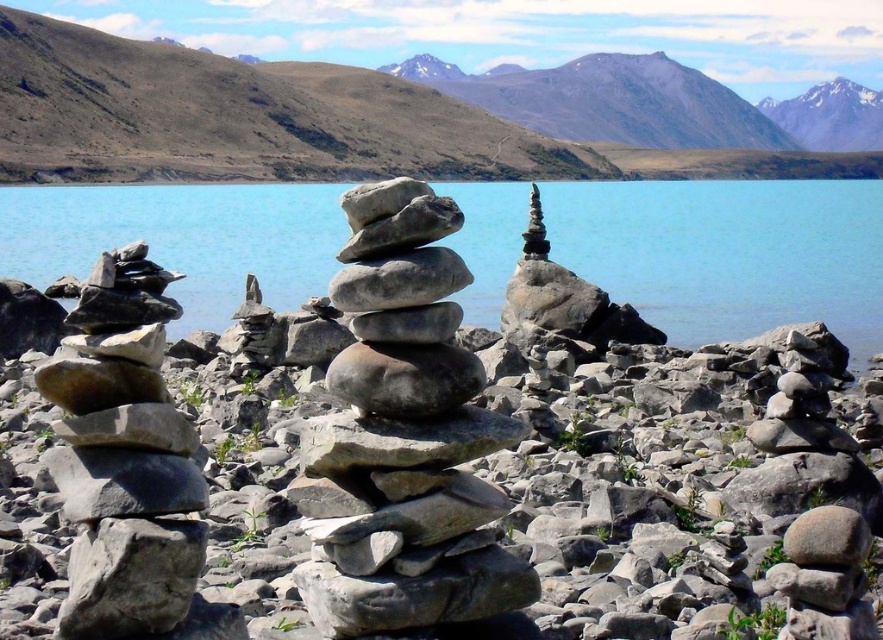
You are a hiker who wants to cross the lake using a small boat. The boat you have can only carry you and up to 200 pounds of gear. The distance between the blue smooth water at center and the gray stone stack at center is crucial for planning your trip. Can you safely make the crossing with your gear without exceeding the boat capacity?

The blue smooth water at center is 711.15 feet from the gray stone stack at center. Since the boat can carry up to 200 pounds, the distance does not affect the boat capacity. Therefore, you can safely make the crossing with your gear as long as the total weight does not exceed 200 pounds.

You are a hiker trying to navigate through the rocky shoreline. You see the gray stone stack at center and the gray rock mountain at upper center. Which object is closer to you?

The gray stone stack at center is closer to you because it is smaller in size compared to the gray rock mountain at upper center, which is larger and further away.